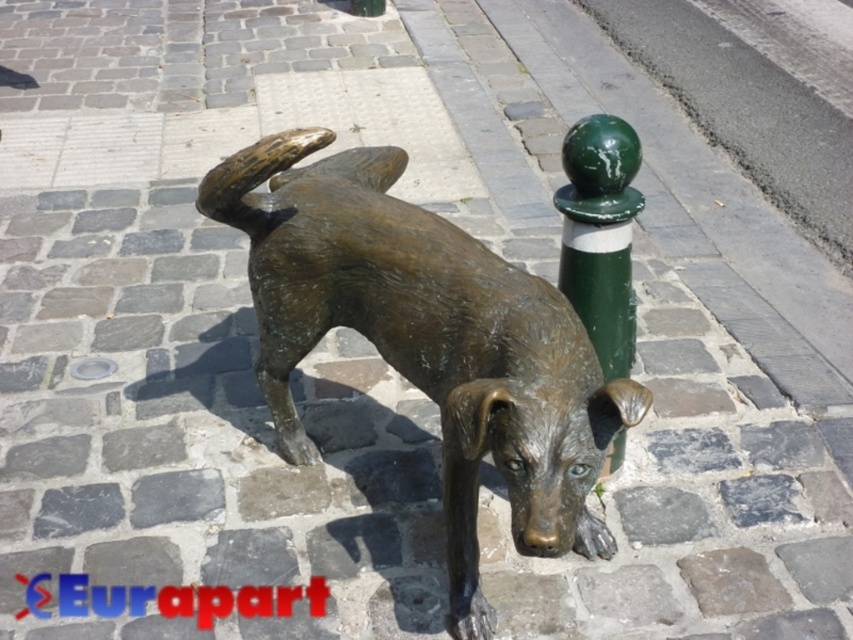
You are standing in front of the bronze statue at center. If you want to take a selfie with it, will you need to step back or step forward to include the entire statue in the frame?

The bronze statue at center is 1.71 meters away from you. To include the entire statue in the frame, you should step back to ensure the statue fits within the camera view.